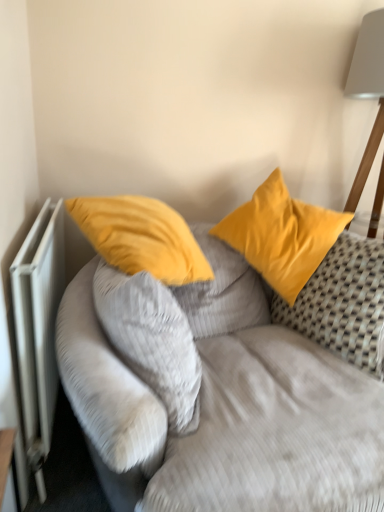
Question: Which direction should I rotate to look at matte yellow pillow at center, the second pillow when ordered from right to left?

Choices:
 (A) left
 (B) right

Answer: (A)

Question: Considering the relative sizes of satin yellow pillow at upper right, which is the second pillow in left-to-right order, and velvet yellow pillows at upper center in the image provided, is satin yellow pillow at upper right, which is the second pillow in left-to-right order, thinner than velvet yellow pillows at upper center?

Choices:
 (A) no
 (B) yes

Answer: (B)

Question: Could you tell me if satin yellow pillow at upper right, which is the second pillow in left-to-right order, is turned towards velvet yellow pillows at upper center?

Choices:
 (A) no
 (B) yes

Answer: (B)

Question: Is satin yellow pillow at upper right, which is the second pillow in left-to-right order, bigger than velvet yellow pillows at upper center?

Choices:
 (A) yes
 (B) no

Answer: (B)

Question: From a real-world perspective, is satin yellow pillow at upper right, which is the 1th pillow from right to left, under velvet yellow pillows at upper center?

Choices:
 (A) yes
 (B) no

Answer: (B)

Question: From a real-world perspective, is satin yellow pillow at upper right, which is the 1th pillow from right to left, positioned over velvet yellow pillows at upper center based on gravity?

Choices:
 (A) yes
 (B) no

Answer: (A)

Question: Considering the relative sizes of satin yellow pillow at upper right, which is the second pillow in left-to-right order, and velvet yellow pillows at upper center in the image provided, is satin yellow pillow at upper right, which is the second pillow in left-to-right order, shorter than velvet yellow pillows at upper center?

Choices:
 (A) yes
 (B) no

Answer: (A)

Question: From a real-world perspective, does satin yellow pillow at upper right, which is the second pillow in left-to-right order, sit lower than matte yellow pillow at center, which is the 1th pillow from left to right?

Choices:
 (A) yes
 (B) no

Answer: (B)

Question: Is satin yellow pillow at upper right, which is the 1th pillow from right to left, far from matte yellow pillow at center, which is the 1th pillow from left to right?

Choices:
 (A) no
 (B) yes

Answer: (A)

Question: From the image's perspective, is satin yellow pillow at upper right, which is the 1th pillow from right to left, under matte yellow pillow at center, which is the 1th pillow from left to right?

Choices:
 (A) yes
 (B) no

Answer: (B)

Question: Does satin yellow pillow at upper right, which is the 1th pillow from right to left, come behind matte yellow pillow at center, the second pillow when ordered from right to left?

Choices:
 (A) yes
 (B) no

Answer: (A)

Question: Is satin yellow pillow at upper right, which is the 1th pillow from right to left, turned away from matte yellow pillow at center, which is the 1th pillow from left to right?

Choices:
 (A) yes
 (B) no

Answer: (B)

Question: Would you say satin yellow pillow at upper right, which is the 1th pillow from right to left, contains matte yellow pillow at center, the second pillow when ordered from right to left?

Choices:
 (A) no
 (B) yes

Answer: (A)

Question: Can matte yellow pillow at center, the second pillow when ordered from right to left, be found inside velvet yellow pillows at upper center?

Choices:
 (A) yes
 (B) no

Answer: (A)